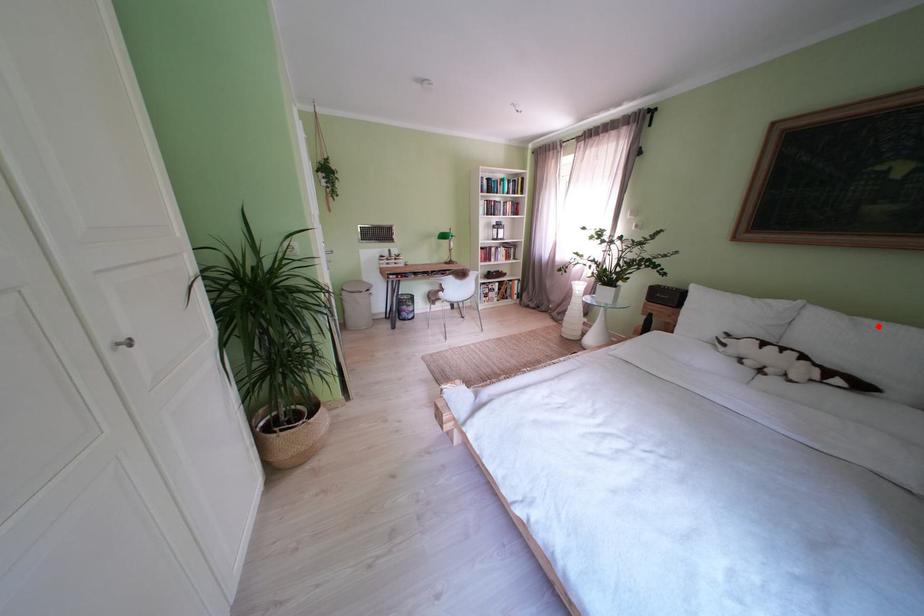
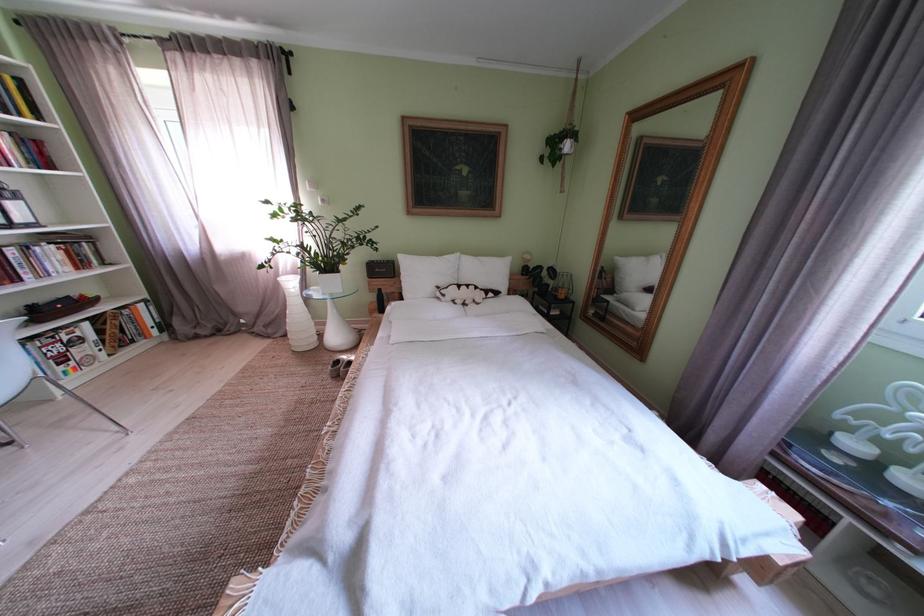
Question: A red point is marked in image1. In image2, is the corresponding 3D point closer to the camera or farther? Reply with the corresponding letter.

Choices:
 (A) The corresponding 3D point is closer.
 (B) The corresponding 3D point is farther.

Answer: (A)